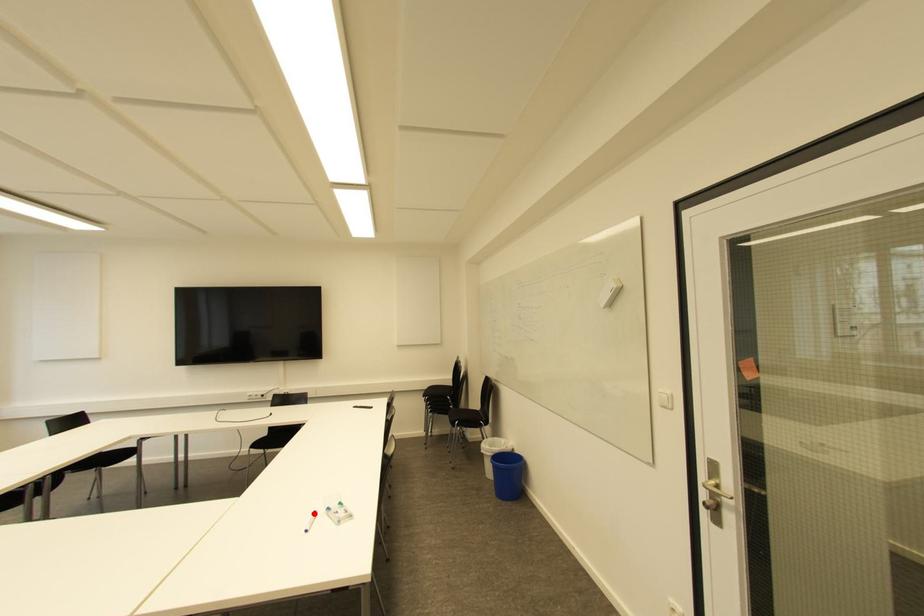
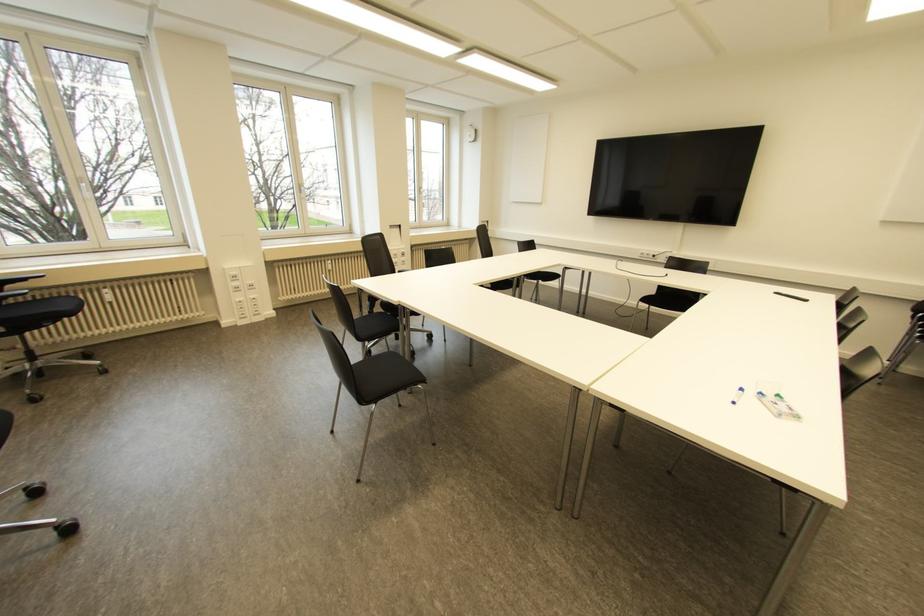
Question: I am providing you with two images of the same scene from different viewpoints. Given a red point in image1, look at the same physical point in image2. Is it:

Choices:
 (A) Closer to the viewpoint
 (B) Farther from the viewpoint

Answer: (A)